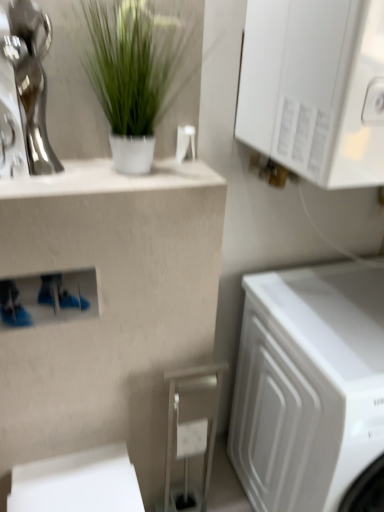
Question: Is shiny silver statue at upper left oriented away from white glossy cabinet at upper right?

Choices:
 (A) yes
 (B) no

Answer: (B)

Question: From the image's perspective, is shiny silver statue at upper left over white glossy cabinet at upper right?

Choices:
 (A) yes
 (B) no

Answer: (B)

Question: Does shiny silver statue at upper left have a greater width compared to white glossy cabinet at upper right?

Choices:
 (A) yes
 (B) no

Answer: (B)

Question: Is shiny silver statue at upper left behind white glossy cabinet at upper right?

Choices:
 (A) yes
 (B) no

Answer: (A)

Question: From a real-world perspective, is shiny silver statue at upper left located beneath white glossy cabinet at upper right?

Choices:
 (A) yes
 (B) no

Answer: (A)

Question: From a real-world perspective, is shiny silver statue at upper left physically above white glossy cabinet at upper right?

Choices:
 (A) yes
 (B) no

Answer: (B)

Question: Does green matte plant at upper center lie in front of white matte washing machine at lower right?

Choices:
 (A) yes
 (B) no

Answer: (A)

Question: Is green matte plant at upper center not near white matte washing machine at lower right?

Choices:
 (A) no
 (B) yes

Answer: (A)

Question: Is green matte plant at upper center facing towards white matte washing machine at lower right?

Choices:
 (A) yes
 (B) no

Answer: (B)

Question: Is green matte plant at upper center in contact with white matte washing machine at lower right?

Choices:
 (A) yes
 (B) no

Answer: (B)

Question: Is green matte plant at upper center to the right of white matte washing machine at lower right from the viewer's perspective?

Choices:
 (A) yes
 (B) no

Answer: (B)

Question: From the image's perspective, would you say green matte plant at upper center is positioned over white matte washing machine at lower right?

Choices:
 (A) yes
 (B) no

Answer: (A)

Question: Is white glossy cabinet at upper right wider than white glossy counter top at upper left?

Choices:
 (A) no
 (B) yes

Answer: (B)